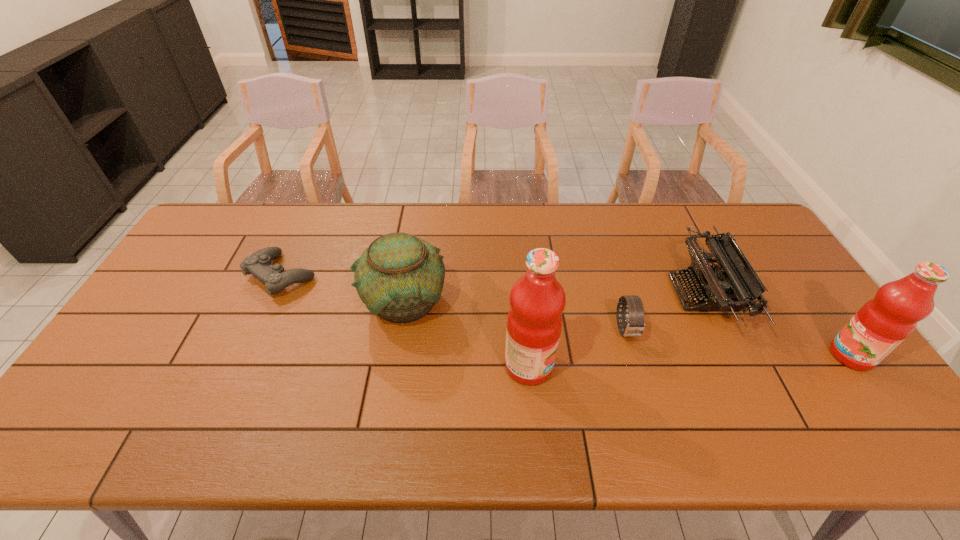
Please show where to add a fruit juice on the left while keeping spacing even. Please provide its 2D coordinates. Your answer should be formatted as a tuple, i.e. [(x, y)], where the tuple contains the x and y coordinates of a point satisfying the conditions above.

[(193, 376)]